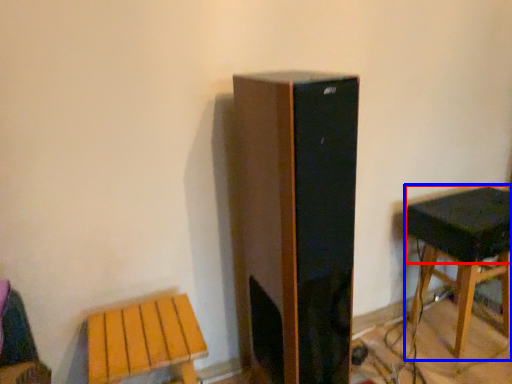
Question: Which object is closer to the camera taking this photo, speaker (highlighted by a red box) or stool (highlighted by a blue box)?

Choices:
 (A) speaker
 (B) stool

Answer: (A)